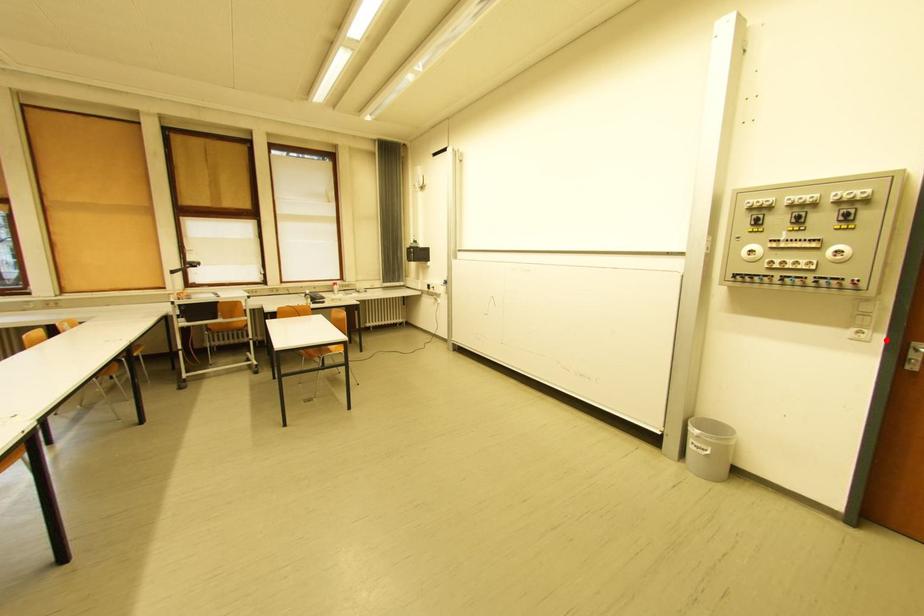
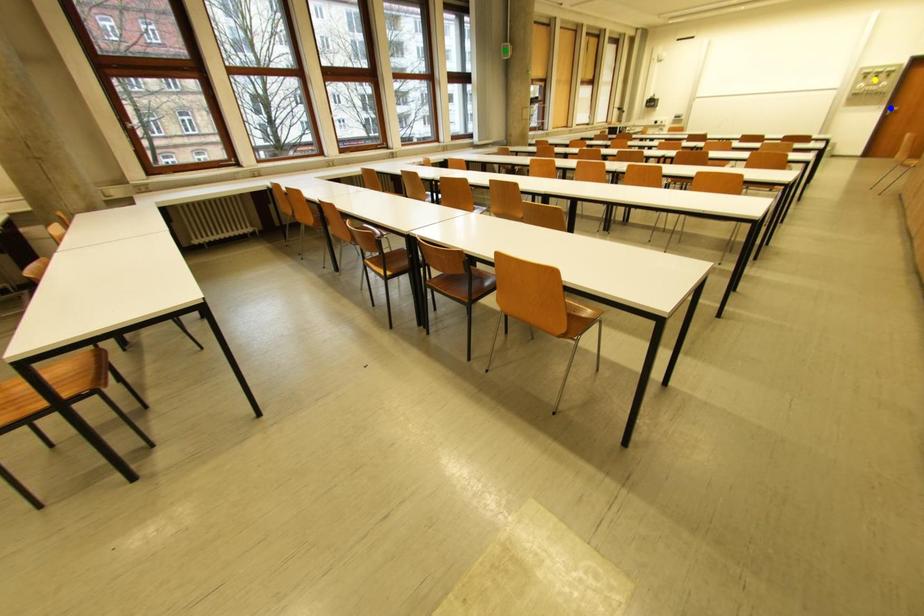
Question: I am providing you with two images of the same scene from different viewpoints. A red point is marked on the first image. You are given multiple points on the second image. In image 2, which mark is for the same physical point as the one in image 1?

Choices:
 (A) blue point
 (B) green point
 (C) yellow point

Answer: (A)